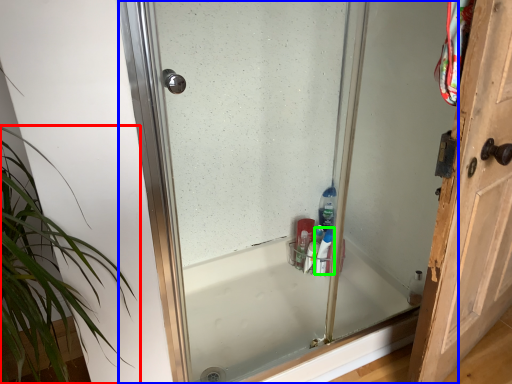
Question: Based on their relative distances, which object is farther from houseplant (highlighted by a red box)? Choose from glass door (highlighted by a blue box) and cleaning product (highlighted by a green box).

Choices:
 (A) glass door
 (B) cleaning product

Answer: (B)